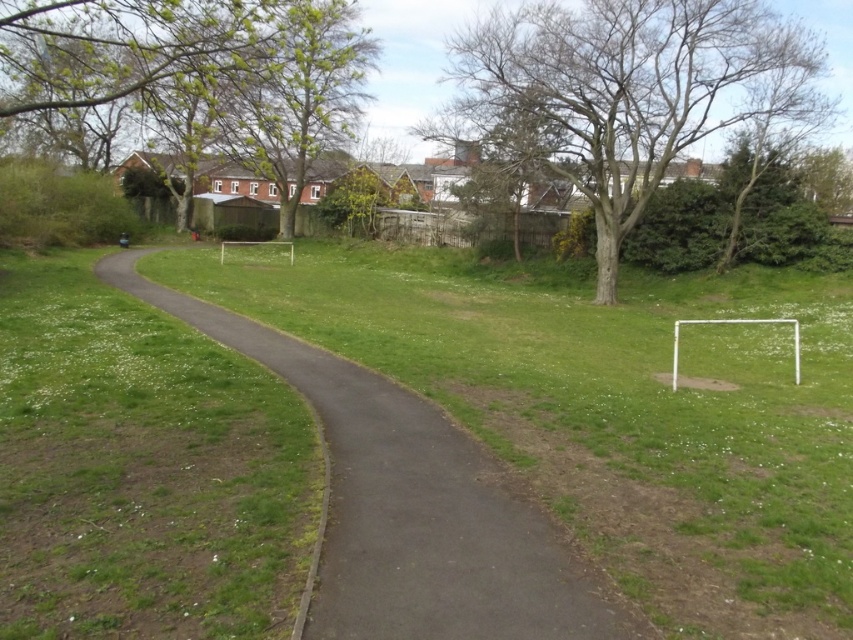
Is bare wood tree at upper center smaller than green leafy tree at upper left?

Yes, bare wood tree at upper center is smaller than green leafy tree at upper left.

Is bare wood tree at upper center further to camera compared to green leafy tree at upper left?

Yes, bare wood tree at upper center is behind green leafy tree at upper left.

Locate an element on the screen. bare wood tree at upper center is located at coordinates (616, 92).

Can you confirm if dark gray asphalt at center is shorter than bare wood tree at upper center?

Yes, dark gray asphalt at center is shorter than bare wood tree at upper center.

Does dark gray asphalt at center appear over bare wood tree at upper center?

No.

Where is `dark gray asphalt at center`? The width and height of the screenshot is (853, 640). dark gray asphalt at center is located at coordinates (410, 506).

This screenshot has height=640, width=853. Find the location of `dark gray asphalt at center`. dark gray asphalt at center is located at coordinates (410, 506).

Can you confirm if dark gray asphalt at center is shorter than green leafy tree at upper left?

Indeed, dark gray asphalt at center has a lesser height compared to green leafy tree at upper left.

Does point (318, 621) come closer to viewer compared to point (279, 189)?

Yes.

Where is `dark gray asphalt at center`? This screenshot has width=853, height=640. dark gray asphalt at center is located at coordinates 410,506.